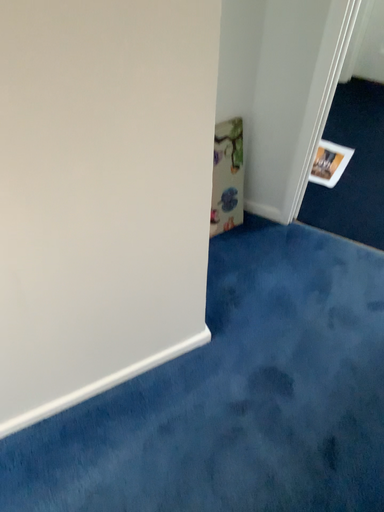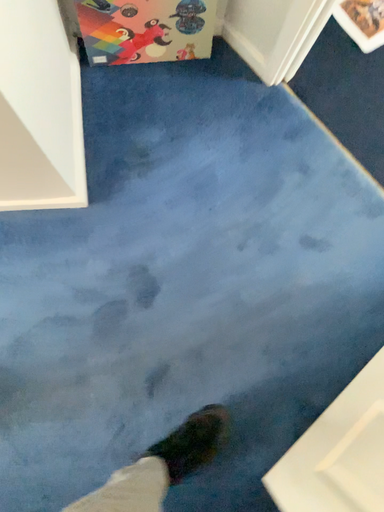
Question: Which way did the camera rotate in the video?

Choices:
 (A) rotated right
 (B) rotated left

Answer: (B)